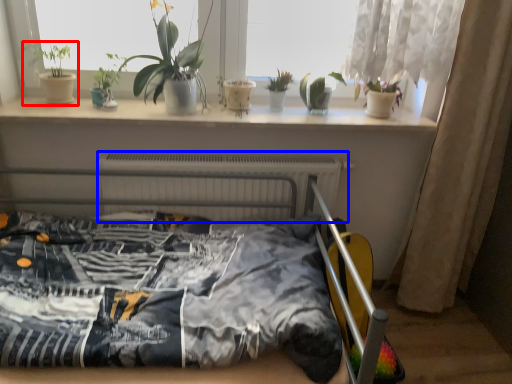
Question: Among these objects, which one is nearest to the camera, houseplant (highlighted by a red box) or radiator (highlighted by a blue box)?

Choices:
 (A) houseplant
 (B) radiator

Answer: (A)